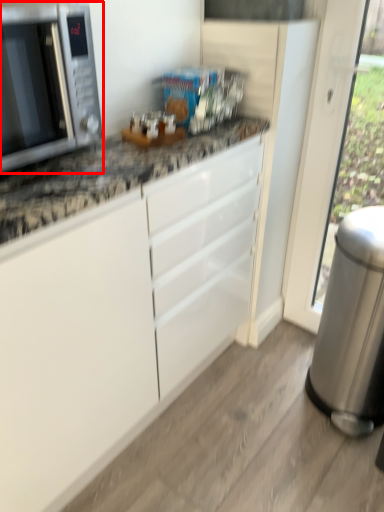
Question: From the image's perspective, considering the relative positions of microwave oven (annotated by the red box) and appliance in the image provided, where is microwave oven (annotated by the red box) located with respect to the staircase?

Choices:
 (A) below
 (B) above

Answer: (B)